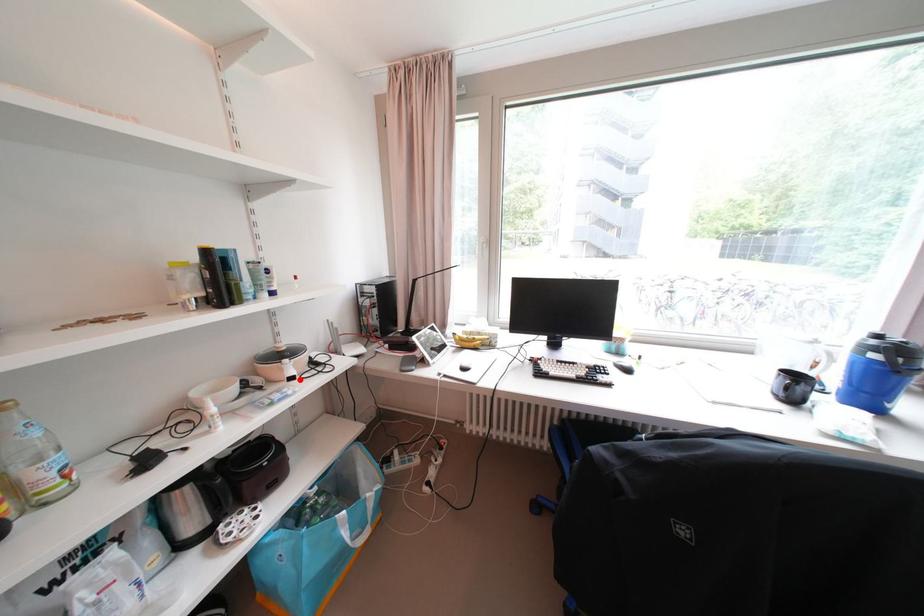
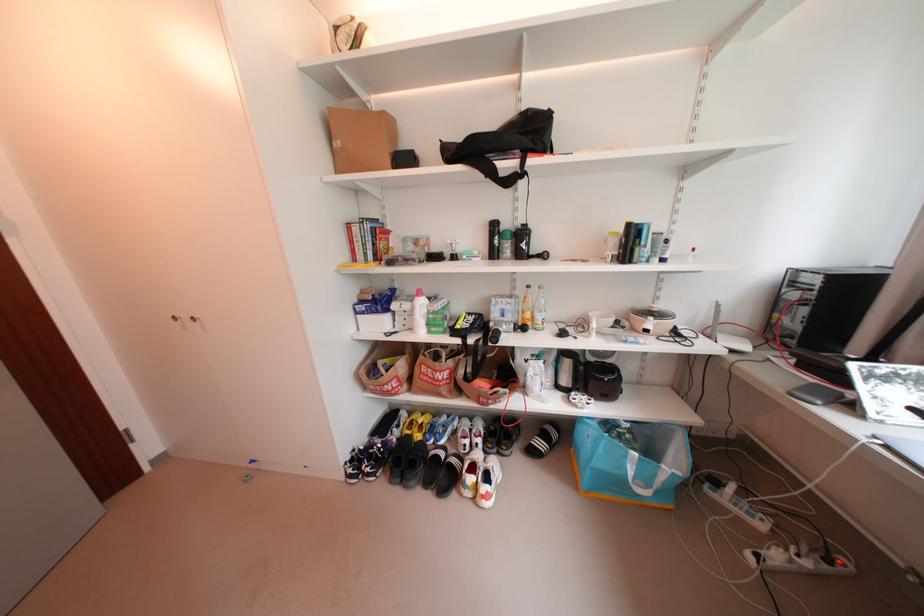
Where in the second image is the point corresponding to the highlighted location from the first image?

(655, 331)